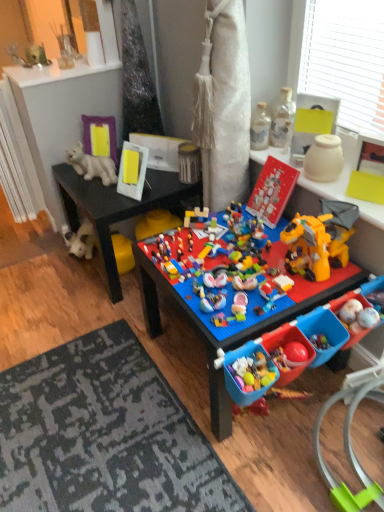
Question: Is point (269, 158) positioned closer to the camera than point (307, 165)?

Choices:
 (A) closer
 (B) farther

Answer: (B)

Question: Would you say matte plastic toy at center, the second toy when ordered from right to left, is inside or outside white matte vase at upper right, the first toy from the right?

Choices:
 (A) outside
 (B) inside

Answer: (A)

Question: Which object is the closest to the clear glass bottle at upper right, the third toy in the right-to-left sequence?

Choices:
 (A) white matte polar bear at upper left, which is the 2th toy in left-to-right order
 (B) white textured radiator at left
 (C) white plush dog at lower left, which ranks as the seventh toy in right-to-left order
 (D) white matte vase at upper right, marked as the 7th toy in a left-to-right arrangement
 (E) blue plastic table at center

Answer: (D)

Question: Estimate the real-world distances between objects in this image. Which object is farther from the white plush dog at lower left, the 1th toy from the left?

Choices:
 (A) brick-like plastic lego set at center, which is counted as the fourth toy, starting from the left
 (B) clear glass bottle at upper right, the third toy in the right-to-left sequence
 (C) blue plastic table at center
 (D) metallic can at center, which ranks as the 5th toy in right-to-left order
 (E) white textured radiator at left

Answer: (B)